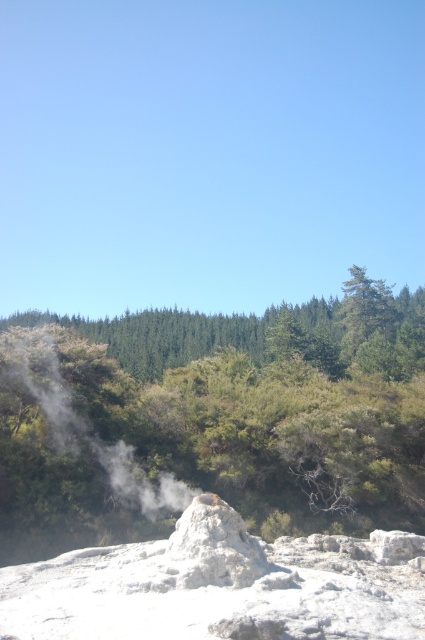
You are a hiker standing near the white vapor at center and the white porous rock at center in the geothermal area. Which object is located higher in elevation?

The white vapor at center is positioned over the white porous rock at center, so the white vapor at center is higher in elevation.

You are a hiker trying to determine the best spot to set up a tent. You have two options near the green leafy forest at center and the white porous rock at center. Considering their heights, which location would provide better shelter from the wind?

The green leafy forest at center is much taller than the white porous rock at center, so setting up the tent near the green leafy forest at center would provide better shelter from the wind due to its greater height blocking wind more effectively.

You are planning to build a small garden shed in the image. You need to choose between placing it in the green leafy forest at center or on the white porous rock at center. Which location has a wider area to accommodate the shed?

The green leafy forest at center might be wider than white porous rock at center, so it could provide a wider area for the shed.